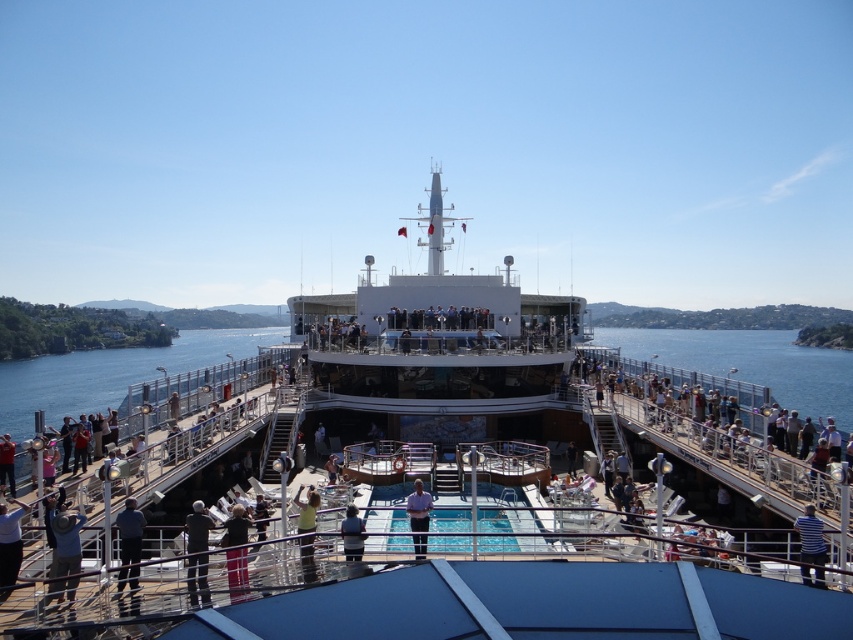
Question: Among these objects, which one is farthest from the camera?

Choices:
 (A) dark blue jeans at lower left
 (B) striped shirt at lower right

Answer: (A)

Question: Can you confirm if light blue shirt at lower left is positioned above striped shirt at lower right?

Choices:
 (A) no
 (B) yes

Answer: (A)

Question: Can you confirm if blue water at right is bigger than striped shirt at lower right?

Choices:
 (A) yes
 (B) no

Answer: (A)

Question: Does blue water at right appear over dark gray fabric jacket at lower center?

Choices:
 (A) yes
 (B) no

Answer: (A)

Question: Which of the following is the farthest from the observer?

Choices:
 (A) (4, 545)
 (B) (358, 545)
 (C) (769, 346)

Answer: (C)

Question: Which object is positioned farthest from the red shirt at left?

Choices:
 (A) dark blue shirt at center
 (B) dark gray fabric jacket at lower center
 (C) striped shirt at lower right
 (D) light brown leather jacket at lower left

Answer: (C)